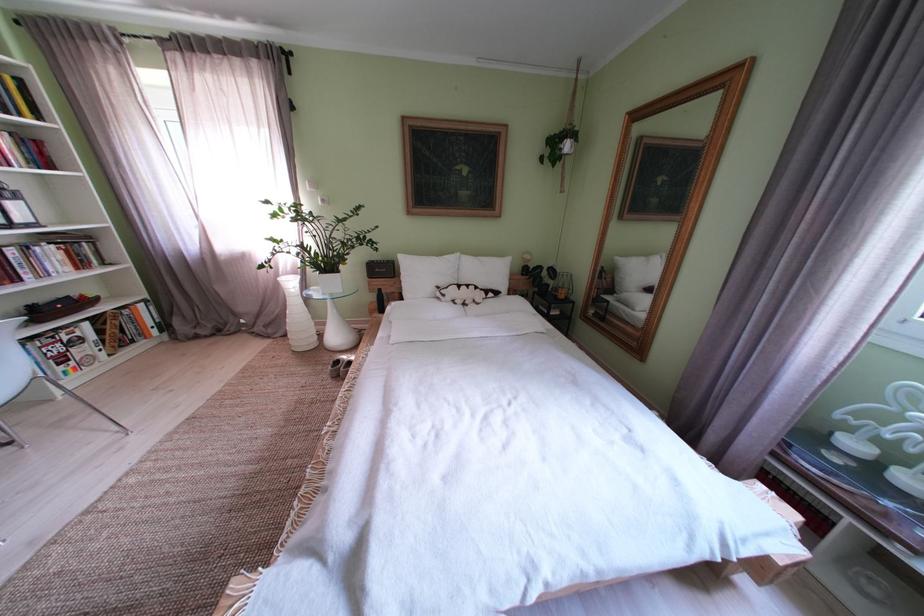
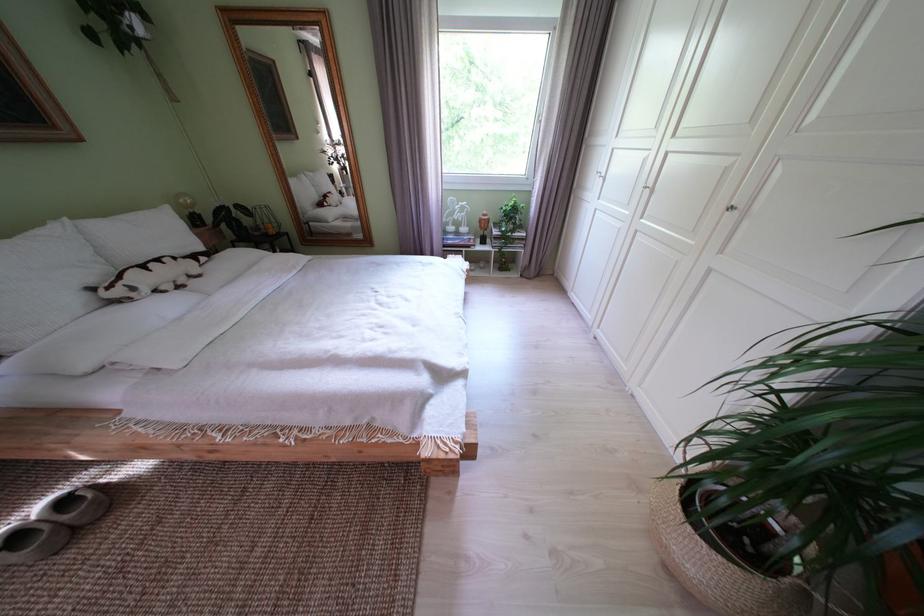
Locate, in the second image, the point that corresponds to the point at 348,367 in the first image.

(28, 543)